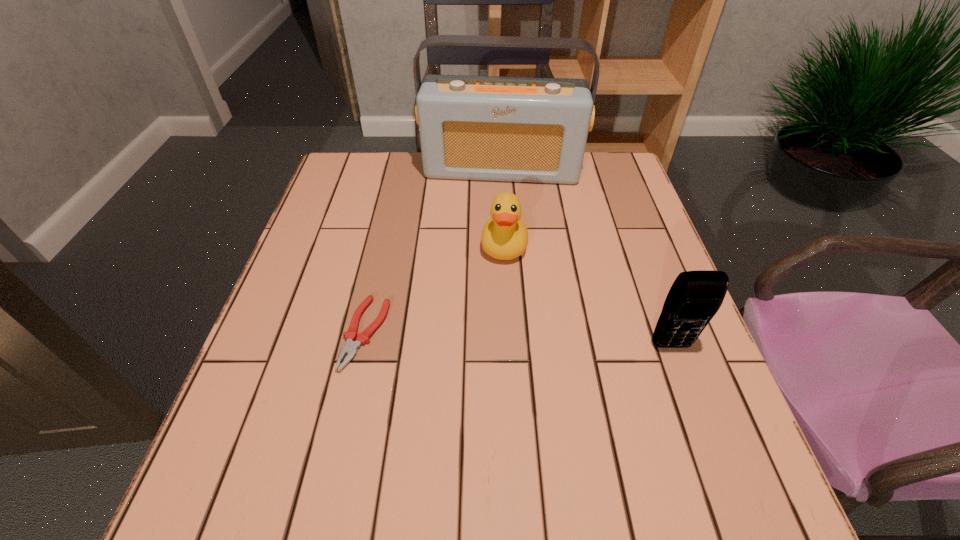
The image size is (960, 540). I want to click on free space located at the beak of the third nearest object, so coord(497,326).

Image resolution: width=960 pixels, height=540 pixels. What are the coordinates of `blank space located 0.400m at the beak of the third nearest object` in the screenshot? It's located at (488, 426).

Locate an element on the screen. free region located 0.290m at the beak of the third nearest object is located at coordinates (493, 372).

Locate an element on the screen. The height and width of the screenshot is (540, 960). vacant space situated 0.280m on the front-facing side of the radio receiver is located at coordinates (492, 252).

The width and height of the screenshot is (960, 540). What are the coordinates of `free space located 0.350m on the front-facing side of the radio receiver` in the screenshot? It's located at (490, 272).

Locate an element on the screen. The image size is (960, 540). free region located 0.060m on the front-facing side of the radio receiver is located at coordinates (495, 199).

Where is `object at the far edge`? The image size is (960, 540). object at the far edge is located at coordinates (520, 129).

In order to click on cellular telephone that is at the right edge in this screenshot , I will do `click(694, 298)`.

At what (x,y) coordinates should I click in order to perform the action: click on radio receiver positioned at the right edge. Please return your answer as a coordinate pair (x, y). The width and height of the screenshot is (960, 540). Looking at the image, I should click on (520, 129).

Locate an element on the screen. object present at the far right corner is located at coordinates (520, 129).